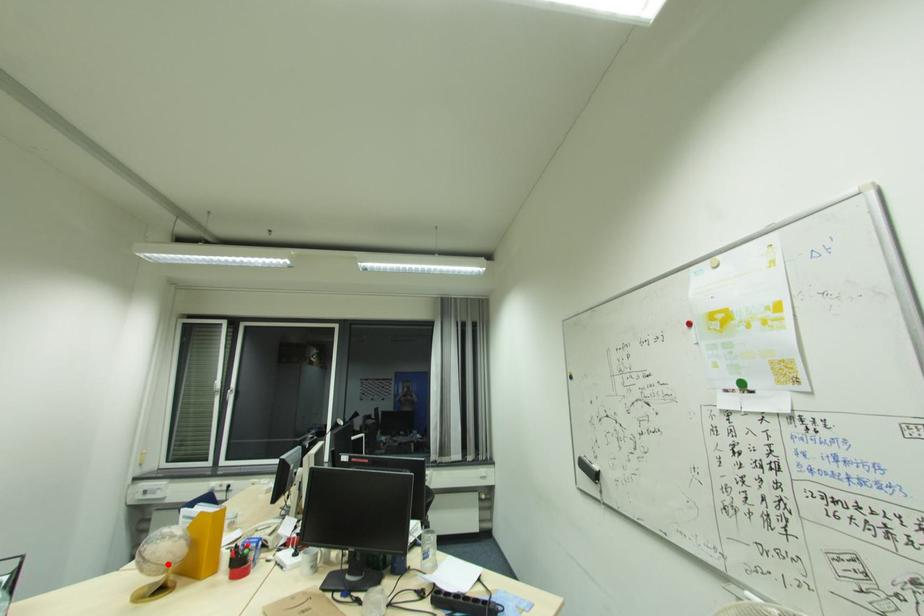
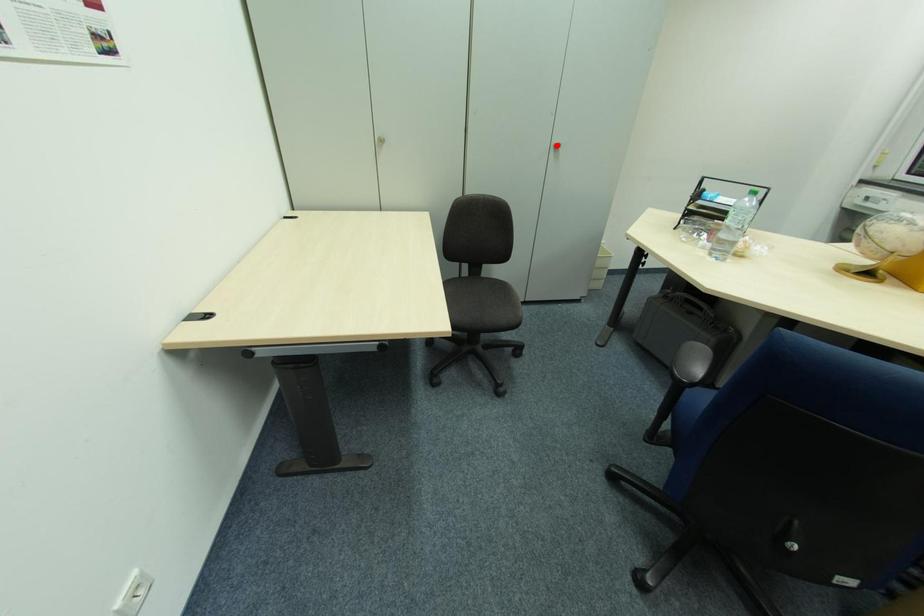
I am providing you with two images of the same scene from different viewpoints. A red point is marked on the first image and another point is marked on the second image. Is the marked point in image1 the same physical position as the marked point in image2?

No